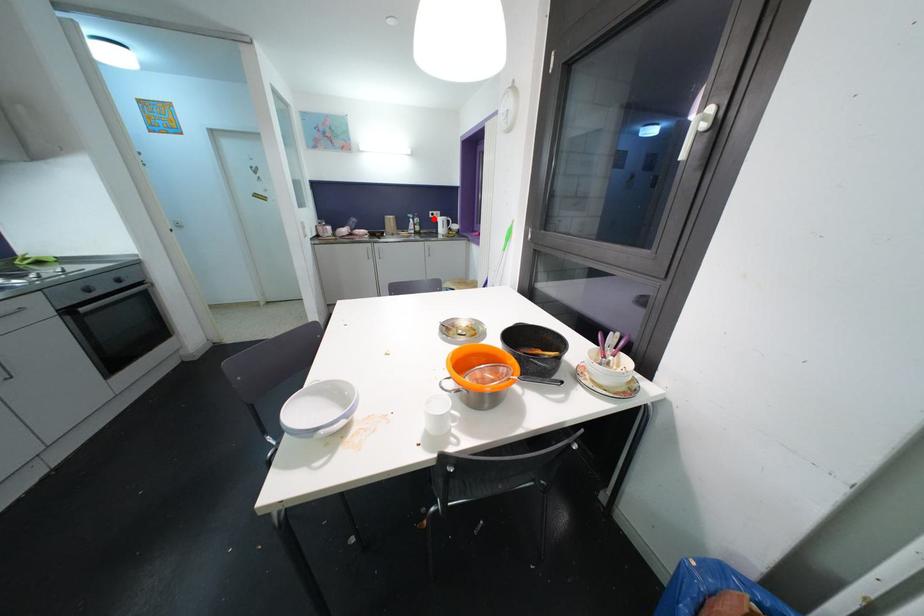
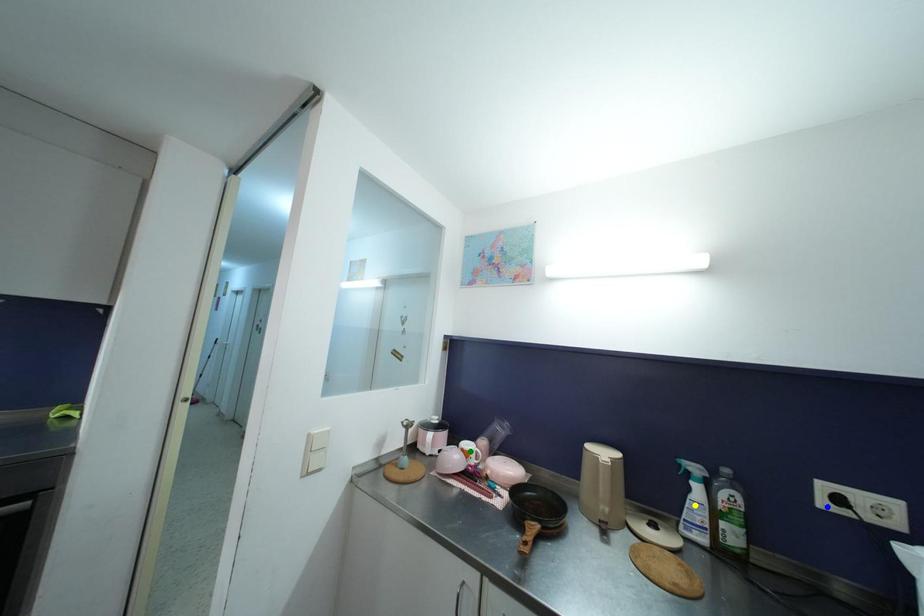
Question: I am providing you with two images of the same scene from different viewpoints. A red point is marked on the first image. You are given multiple points on the second image. In image 2, which mark is for the same physical point as the one in image 1?

Choices:
 (A) green point
 (B) blue point
 (C) yellow point

Answer: (B)